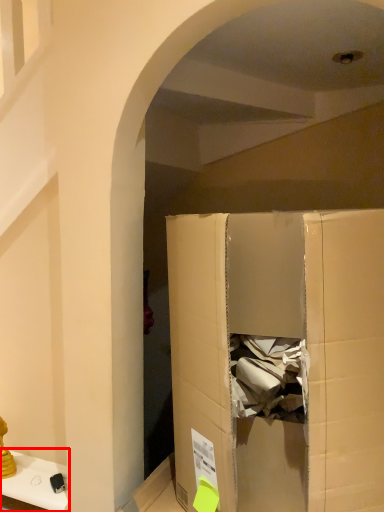
Question: From the image's perspective, what is the correct spatial relationship of furniture (annotated by the red box) in relation to cardboard box?

Choices:
 (A) above
 (B) below

Answer: (B)